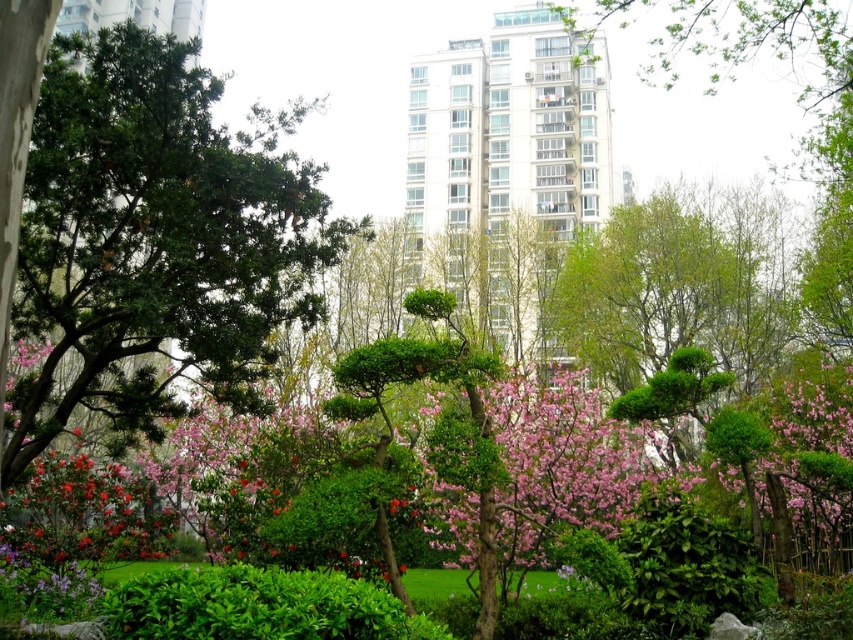
Question: Which point is closer to the camera taking this photo?

Choices:
 (A) [157, 634]
 (B) [206, 129]

Answer: (A)

Question: Does green needle-like at left have a smaller size compared to pink bloom at center?

Choices:
 (A) no
 (B) yes

Answer: (A)

Question: Which is nearer to the green leafy bush at lower center?

Choices:
 (A) green needle-like at left
 (B) pink bloom at center

Answer: (B)

Question: Does pink bloom at center come behind green leafy bush at lower center?

Choices:
 (A) no
 (B) yes

Answer: (B)

Question: Which of the following is the closest to the observer?

Choices:
 (A) (498, 544)
 (B) (125, 593)
 (C) (86, 68)

Answer: (B)

Question: Can you confirm if green needle-like at left is positioned above green leafy bush at lower center?

Choices:
 (A) no
 (B) yes

Answer: (B)